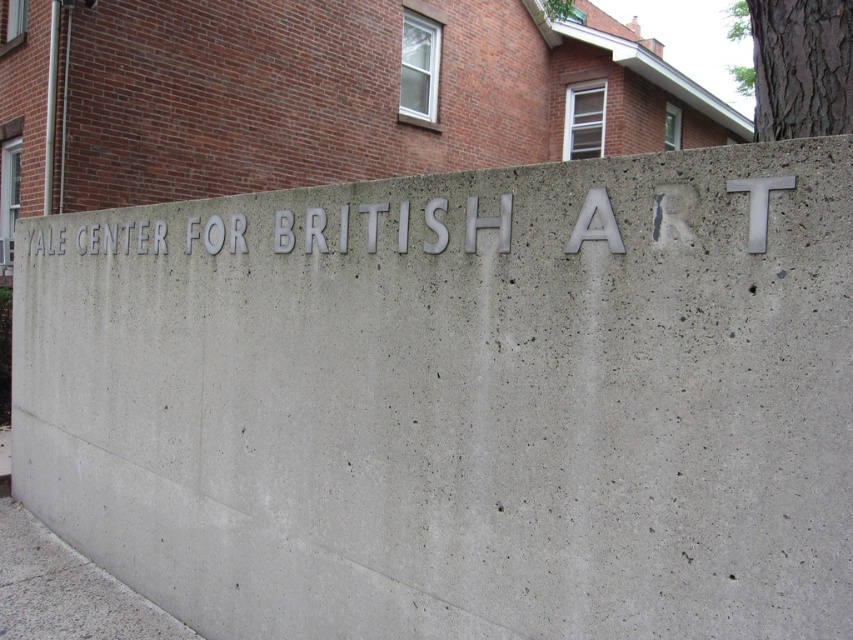
You are a painter standing 1.6 meters away from the silver metallic letters at center. Can you comfortably paint the letters without needing to move closer or farther?

The silver metallic letters at center and viewer are 1.55 meters apart from each other. Since you are standing 1.6 meters away, you are slightly farther than the distance specified. Therefore, you might need to move a bit closer to comfortably paint the letters.

In the scene shown: You are an artist planning to paint a mural on the wall with the silver metallic letters at center and the brown textured bark at upper right. To ensure proper scaling, you need to know which object is taller. Which one is taller?

The brown textured bark at upper right is taller than the silver metallic letters at center.

You are standing in front of the Yale Center for British Art and want to take a photo of both the silver metallic letters at center and the brown textured bark at upper right. Which object should you focus on first to ensure both are in clear view?

You should focus on the silver metallic letters at center first since it is closer to you than the brown textured bark at upper right, ensuring both are in focus when taking the photo.